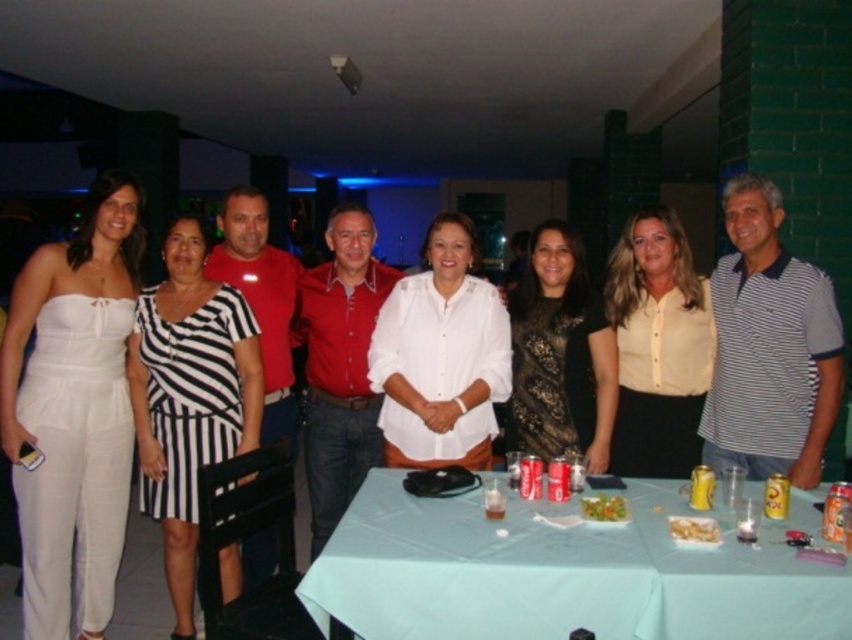
Measure the distance between point (194, 552) and camera.

Point (194, 552) is 10.08 feet away from camera.

Is the position of black and white striped dress at center more distant than that of red cotton shirt at center?

No, black and white striped dress at center is in front of red cotton shirt at center.

Is point (240, 403) positioned in front of point (315, 372)?

That is True.

Where is `black and white striped dress at center`? black and white striped dress at center is located at coordinates (188, 396).

Who is taller, white satin jumpsuit at left or matte red shirt at center?

With more height is white satin jumpsuit at left.

Does white satin jumpsuit at left have a greater width compared to matte red shirt at center?

Yes, white satin jumpsuit at left is wider than matte red shirt at center.

This screenshot has height=640, width=852. I want to click on white satin jumpsuit at left, so click(73, 410).

This screenshot has height=640, width=852. I want to click on white satin jumpsuit at left, so click(x=73, y=410).

Does light blue fabric table at center have a lesser height compared to red cotton shirt at center?

Correct, light blue fabric table at center is not as tall as red cotton shirt at center.

Who is more distant from viewer, (x=602, y=589) or (x=347, y=336)?

The point (x=347, y=336) is behind.

At what (x,y) coordinates should I click in order to perform the action: click on light blue fabric table at center. Please return your answer as a coordinate pair (x, y). This screenshot has width=852, height=640. Looking at the image, I should click on (565, 572).